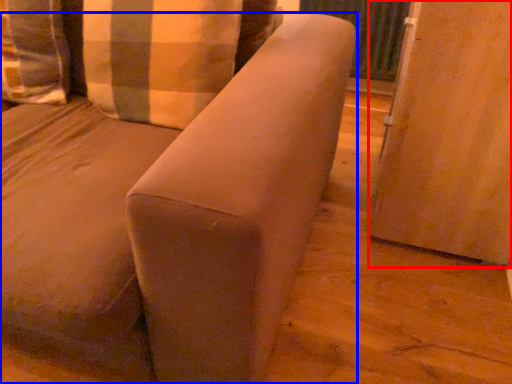
Question: Which object is further to the camera taking this photo, screen door (highlighted by a red box) or furniture (highlighted by a blue box)?

Choices:
 (A) screen door
 (B) furniture

Answer: (A)